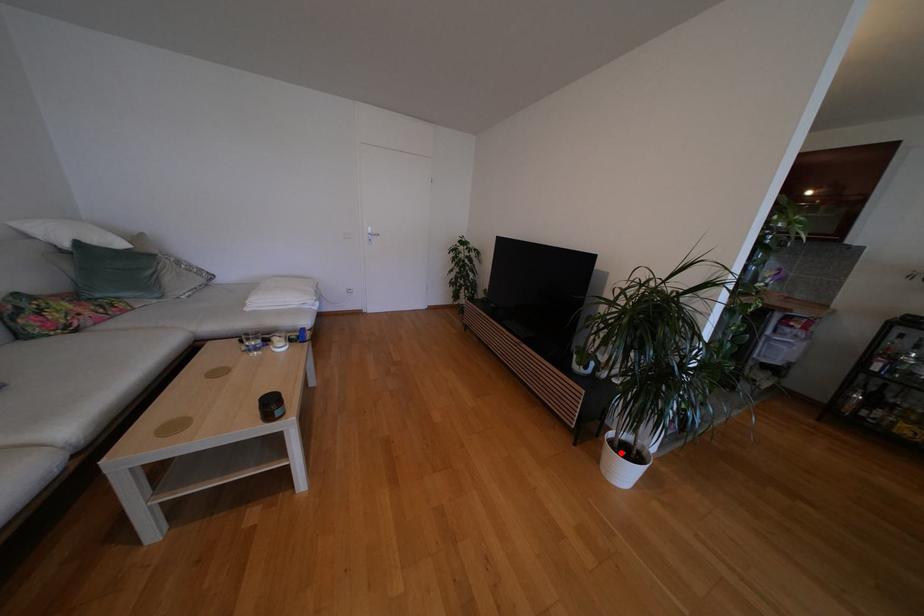
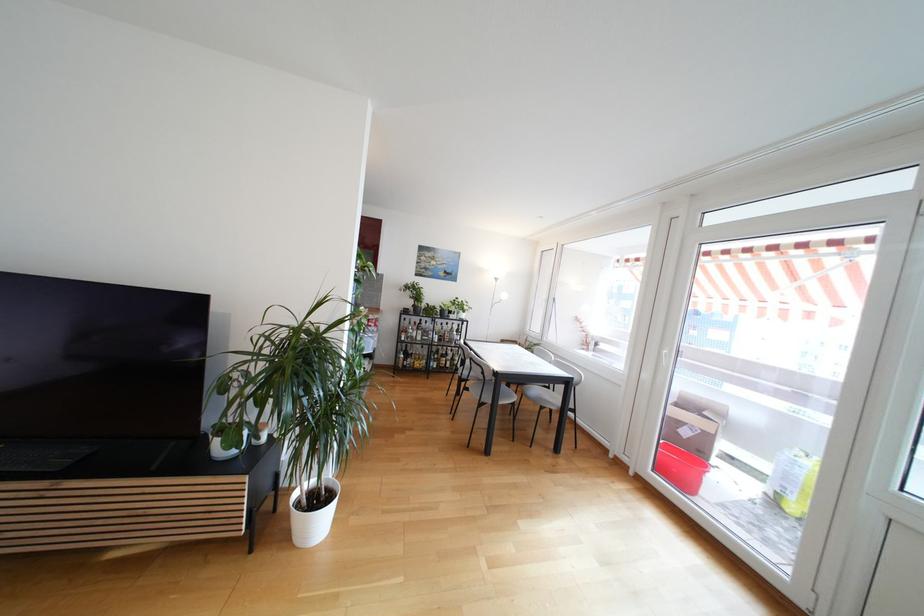
In the second image, find the point that corresponds to the highlighted location in the first image.

(310, 511)